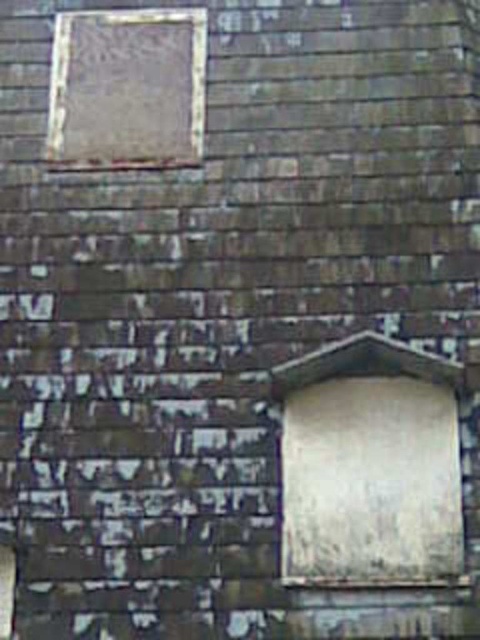
Question: Which of the following is the farthest from the observer?

Choices:
 (A) white matte window at lower right
 (B) matte glass window at upper left

Answer: (B)

Question: Which point is closer to the camera?

Choices:
 (A) matte glass window at upper left
 (B) white matte window at lower right

Answer: (B)

Question: Is white matte window at lower right to the right of matte glass window at upper left from the viewer's perspective?

Choices:
 (A) yes
 (B) no

Answer: (A)

Question: Is white matte window at lower right closer to camera compared to matte glass window at upper left?

Choices:
 (A) no
 (B) yes

Answer: (B)

Question: Which point is closer to the camera?

Choices:
 (A) [86, 129]
 (B) [355, 477]

Answer: (B)

Question: Is white matte window at lower right closer to camera compared to matte glass window at upper left?

Choices:
 (A) yes
 (B) no

Answer: (A)